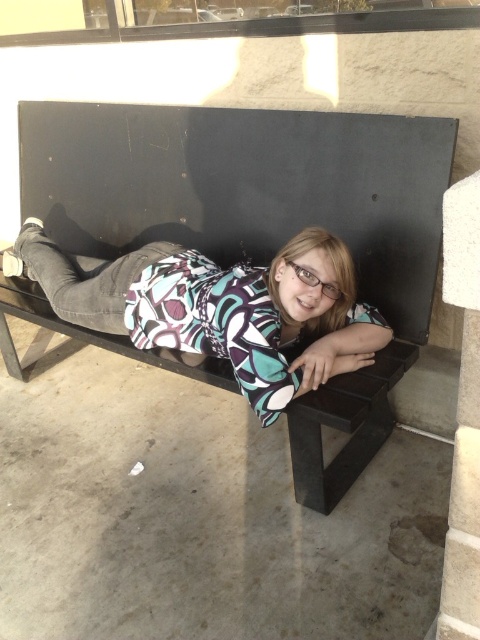
You are a photographer trying to capture the entire scene of the matte black bench at center and the matte black shirt at center in one shot. Based on their sizes, which object will appear bigger in the photo?

The matte black bench at center will appear bigger in the photo since it has a larger size compared to the matte black shirt at center.

You are a photographer trying to capture the person on the matte black bench at center and the matte black shirt at center. Since both objects are matte black, how can you differentiate them in your photo?

The matte black bench at center is in front of the matte black shirt at center, so the bench will appear closer to the camera and block part of the shirt, allowing you to differentiate them based on their relative positions.

You are standing at the origin point in the image. There is a matte black bench at center represented by point [261,221]. Can you tell me the coordinates of the matte black bench at center?

The coordinates of the matte black bench at center are point [261,221].